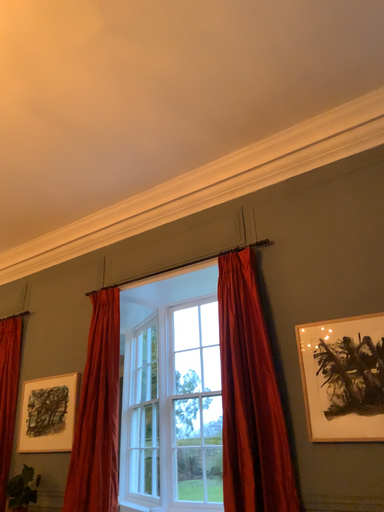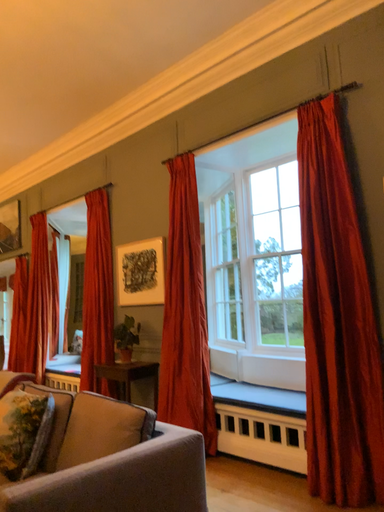
Question: Which way did the camera rotate in the video?

Choices:
 (A) rotated upward
 (B) rotated downward

Answer: (B)